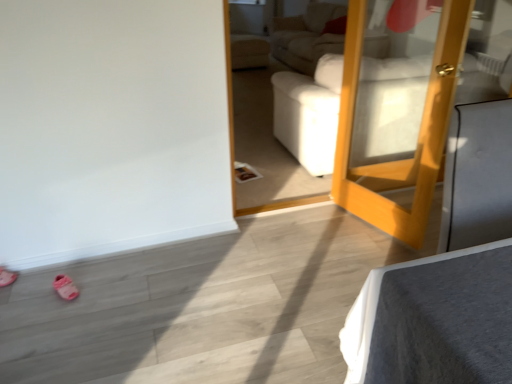
Question: Is pink fabric shoe at lower left, acting as the second shoe starting from the left, at the back of pink rubber shoe at lower left, marked as the second shoe in a right-to-left arrangement?

Choices:
 (A) yes
 (B) no

Answer: (B)

Question: Is pink rubber shoe at lower left, marked as the second shoe in a right-to-left arrangement, shorter than pink fabric shoe at lower left, which ranks as the first shoe in right-to-left order?

Choices:
 (A) no
 (B) yes

Answer: (B)

Question: Does pink rubber shoe at lower left, arranged as the 1th shoe when viewed from the left, have a larger size compared to pink fabric shoe at lower left, acting as the second shoe starting from the left?

Choices:
 (A) yes
 (B) no

Answer: (A)

Question: Is the depth of pink rubber shoe at lower left, arranged as the 1th shoe when viewed from the left, less than that of pink fabric shoe at lower left, acting as the second shoe starting from the left?

Choices:
 (A) no
 (B) yes

Answer: (A)

Question: From the image's perspective, is pink rubber shoe at lower left, marked as the second shoe in a right-to-left arrangement, beneath pink fabric shoe at lower left, acting as the second shoe starting from the left?

Choices:
 (A) yes
 (B) no

Answer: (B)

Question: Would you consider pink rubber shoe at lower left, arranged as the 1th shoe when viewed from the left, to be distant from pink fabric shoe at lower left, which ranks as the first shoe in right-to-left order?

Choices:
 (A) no
 (B) yes

Answer: (A)

Question: From the image's perspective, is pink fabric shoe at lower left, which ranks as the first shoe in right-to-left order, on top of wooden mirror at right?

Choices:
 (A) no
 (B) yes

Answer: (A)

Question: Is pink fabric shoe at lower left, acting as the second shoe starting from the left, positioned with its back to wooden mirror at right?

Choices:
 (A) no
 (B) yes

Answer: (A)

Question: Does pink fabric shoe at lower left, which ranks as the first shoe in right-to-left order, have a lesser height compared to wooden mirror at right?

Choices:
 (A) no
 (B) yes

Answer: (B)

Question: Could you tell me if pink fabric shoe at lower left, which ranks as the first shoe in right-to-left order, is facing wooden mirror at right?

Choices:
 (A) no
 (B) yes

Answer: (A)

Question: Does pink fabric shoe at lower left, acting as the second shoe starting from the left, have a larger size compared to wooden mirror at right?

Choices:
 (A) yes
 (B) no

Answer: (B)

Question: From a real-world perspective, is pink fabric shoe at lower left, acting as the second shoe starting from the left, positioned over wooden mirror at right based on gravity?

Choices:
 (A) no
 (B) yes

Answer: (A)

Question: From the image's perspective, is pink fabric shoe at lower left, acting as the second shoe starting from the left, below pink rubber shoe at lower left, arranged as the 1th shoe when viewed from the left?

Choices:
 (A) no
 (B) yes

Answer: (B)